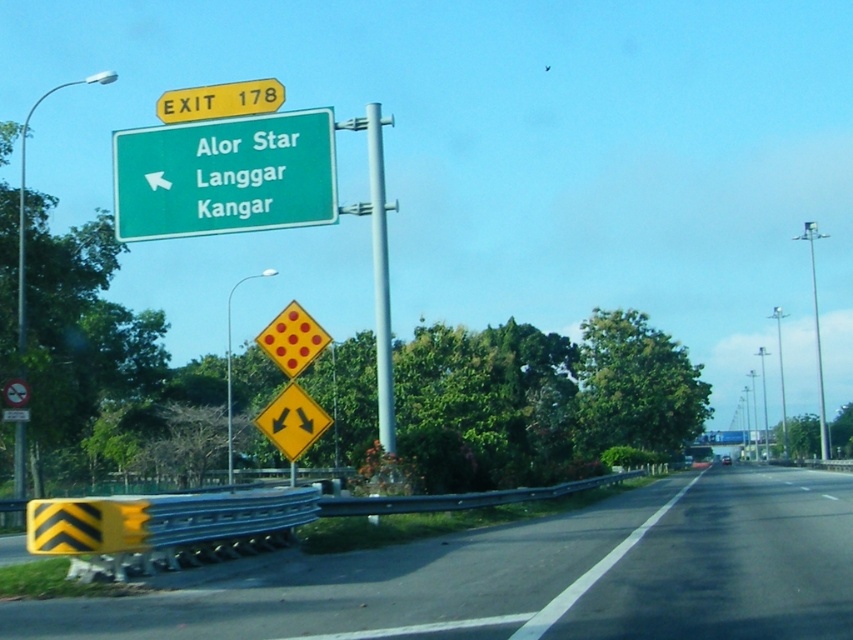
You are a truck driver approaching a highway exit. You see a yellow reflective plastic guardrail at lower left and a yellow matte exit sign at upper center. Which object is closer to you?

The yellow reflective plastic guardrail at lower left is closer to you as it is only 47.53 feet away from the yellow matte exit sign at upper center.

You are driving a car and need to reach a point at coordinates point [618,618]. The road ahead has a speed limit of 60 mph. If you are currently 32.32 feet away from the point, how many seconds do you have before reaching it?

The distance of point [618,618] from camera is 32.32 feet. To calculate the time, first convert 60 mph to feet per second. 60 mph is 88 feet per second. Time is distance divided by speed, so 32.32 divided by 88 equals approximately 0.367 seconds. Therefore, you have about 0.367 seconds before reaching the point.

You are a driver approaching the highway exit. You notice the yellow reflective plastic guardrail at lower left and the yellow matte exit sign at upper center. Which object is taller?

The yellow reflective plastic guardrail at lower left is taller than the yellow matte exit sign at upper center.